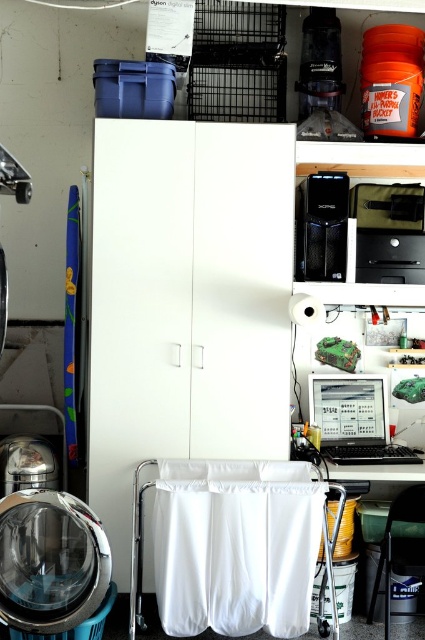
This screenshot has height=640, width=425. What do you see at coordinates (51, 561) in the screenshot?
I see `blue plastic washing machine at lower left` at bounding box center [51, 561].

Does point (22, 502) come closer to viewer compared to point (337, 461)?

That is True.

This screenshot has width=425, height=640. Identify the location of blue plastic washing machine at lower left. (51, 561).

Does white fabric laundry at lower center have a greater height compared to blue plastic washing machine at lower left?

Correct, white fabric laundry at lower center is much taller as blue plastic washing machine at lower left.

Is white fabric laundry at lower center shorter than blue plastic washing machine at lower left?

No.

Who is more distant from viewer, (266,612) or (73,602)?

The point (266,612) is more distant.

This screenshot has height=640, width=425. What are the coordinates of `white fabric laundry at lower center` in the screenshot? It's located at (235, 545).

Does white fabric laundry at lower center have a smaller size compared to matte black computer at center?

No, white fabric laundry at lower center is not smaller than matte black computer at center.

Is white fabric laundry at lower center taller than matte black computer at center?

Indeed, white fabric laundry at lower center has a greater height compared to matte black computer at center.

Image resolution: width=425 pixels, height=640 pixels. Find the location of `white fabric laundry at lower center`. white fabric laundry at lower center is located at coordinates (235, 545).